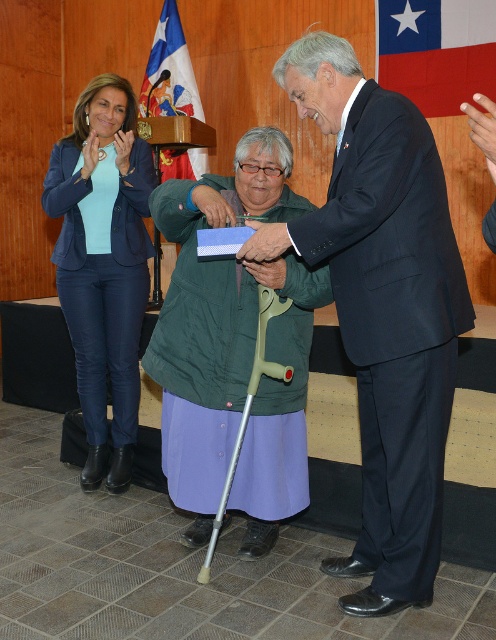
Between green fabric crutch at center and red fabric flag at upper right, which one is positioned lower?

green fabric crutch at center is lower down.

Can you confirm if green fabric crutch at center is positioned above red fabric flag at upper right?

Incorrect, green fabric crutch at center is not positioned above red fabric flag at upper right.

Is point (243, 380) farther from camera compared to point (415, 84)?

No, (243, 380) is closer to viewer.

This screenshot has height=640, width=496. Identify the location of green fabric crutch at center. (234, 349).

Is the position of dark blue suit at center less distant than that of green fabric crutch at center?

Yes, it is in front of green fabric crutch at center.

Does dark blue suit at center appear over green fabric crutch at center?

Yes.

Where is `dark blue suit at center`? dark blue suit at center is located at coordinates (382, 308).

In the scene shown: Who is lower down, matte blue blazer at left or red fabric flag at upper right?

matte blue blazer at left

Can you confirm if matte blue blazer at left is positioned to the right of red fabric flag at upper right?

Incorrect, matte blue blazer at left is not on the right side of red fabric flag at upper right.

Between point (93, 104) and point (494, 28), which one is positioned in front?

Positioned in front is point (93, 104).

Locate an element on the screen. The image size is (496, 640). matte blue blazer at left is located at coordinates (103, 262).